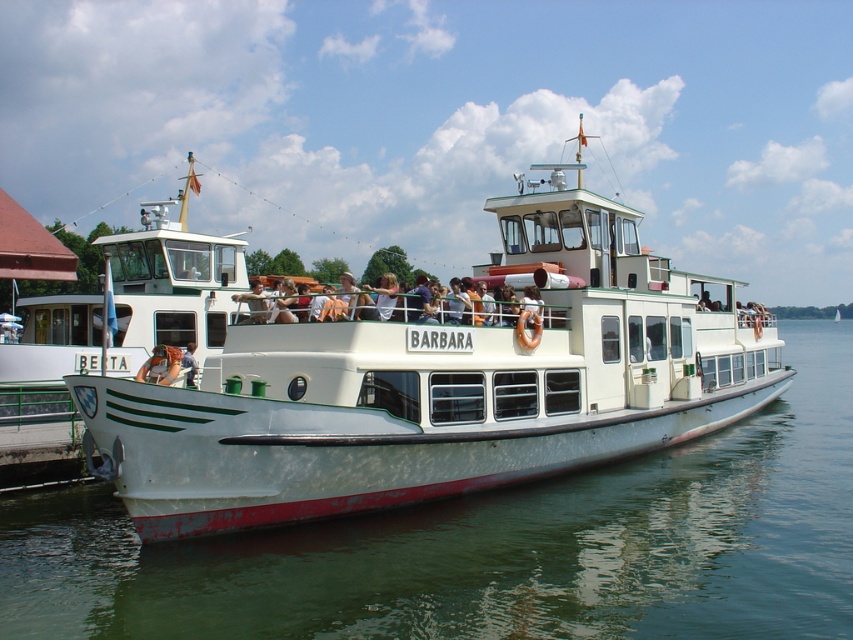
You are a photographer planning to take a photo of the white matte boat at center and the white water at center. Which object will occupy less space in your photo?

The white water at center has a smaller size compared to the white matte boat at center, so it will occupy less space in the photo.

In the scene shown: You are standing on the pier next to the white matte boat at center and the matte white shirt at center. If you want to place both items on a shelf that can only hold items up to the height of the taller one, which item should determine the maximum height allowed?

The white matte boat at center has a greater height compared to the matte white shirt at center, so the maximum height allowed should be determined by the white matte boat at center.